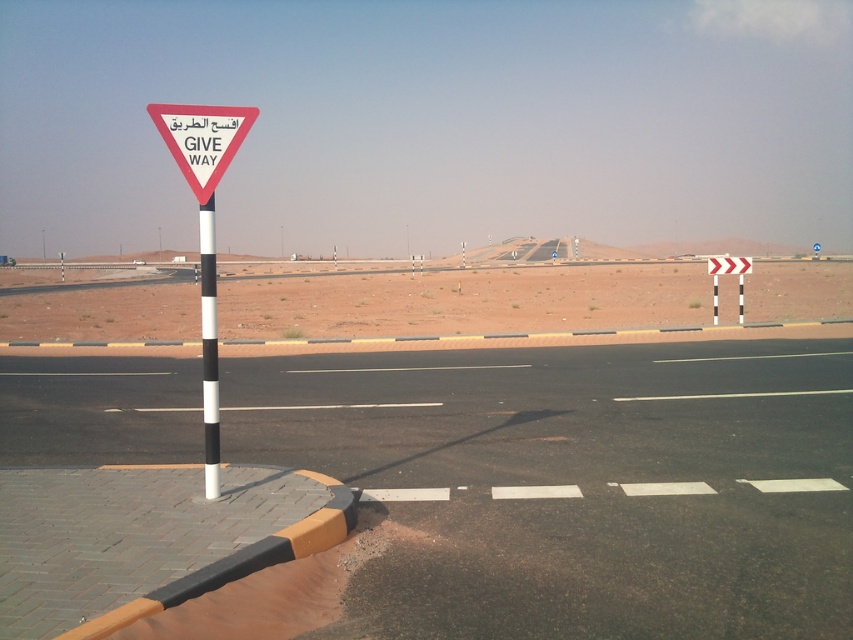
Does desert sand at center appear on the left side of white triangular sign at center?

Incorrect, desert sand at center is not on the left side of white triangular sign at center.

Between point (619, 268) and point (216, 156), which one is positioned behind?

Point (619, 268)

Locate an element on the screen. This screenshot has height=640, width=853. desert sand at center is located at coordinates (465, 300).

Can you confirm if black asphalt highway at left is bigger than white triangular sign at center?

Yes.

Is point (461, 566) positioned in front of point (233, 118)?

Yes, point (461, 566) is in front of point (233, 118).

You are a GUI agent. You are given a task and a screenshot of the screen. Output one action in this format:
    pyautogui.click(x=<x>, y=<y>)
    Task: Click on the black asphalt highway at left
    
    Given the screenshot: What is the action you would take?
    pyautogui.click(x=576, y=483)

Between desert sand at center and black and white striped pole at left, which one appears on the left side from the viewer's perspective?

black and white striped pole at left is more to the left.

Which is above, desert sand at center or black and white striped pole at left?

Positioned higher is desert sand at center.

Which is in front, point (843, 276) or point (213, 358)?

Positioned in front is point (213, 358).

Locate an element on the screen. This screenshot has height=640, width=853. desert sand at center is located at coordinates (465, 300).